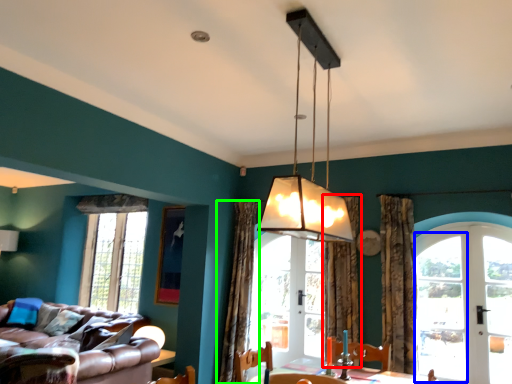
Question: Estimate the real-world distances between objects in this image. Which object is closer to curtain (highlighted by a red box), glass door (highlighted by a blue box) or curtain (highlighted by a green box)?

Choices:
 (A) glass door
 (B) curtain

Answer: (A)